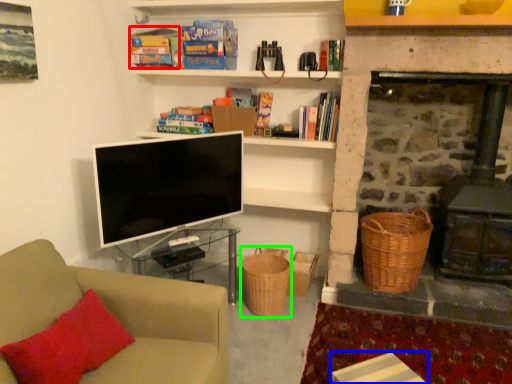
Question: Which is farther away from book (highlighted by a red box)? table (highlighted by a blue box) or basket (highlighted by a green box)?

Choices:
 (A) table
 (B) basket

Answer: (A)